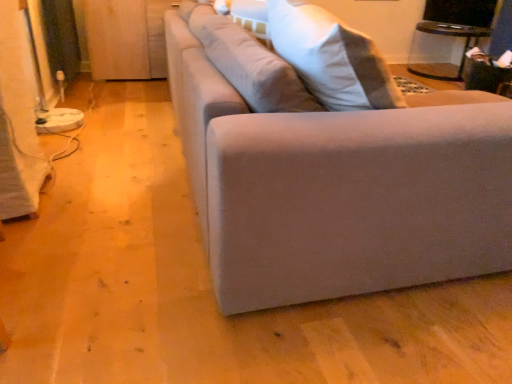
Question: Looking at the image, does suede-like beige couch at center seem bigger or smaller compared to wooden at left?

Choices:
 (A) small
 (B) big

Answer: (B)

Question: Looking at their shapes, would you say suede-like beige couch at center is wider or thinner than wooden at left?

Choices:
 (A) thin
 (B) wide

Answer: (B)

Question: Based on their relative distances, which object is nearer to the transparent glass table at upper right?

Choices:
 (A) suede-like beige couch at center
 (B) wooden at left

Answer: (B)

Question: Which is farther from the transparent glass table at upper right?

Choices:
 (A) suede-like beige couch at center
 (B) wooden at left

Answer: (A)